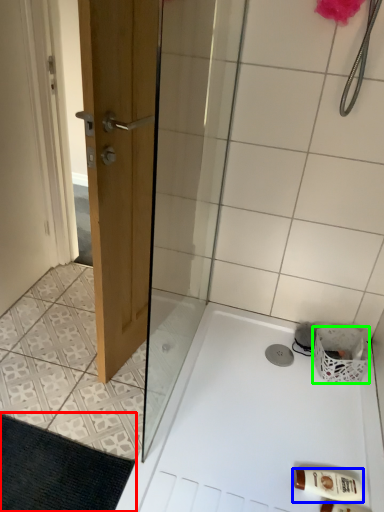
Question: Which object is positioned farthest from bath mat (highlighted by a red box)? Select from toiletry (highlighted by a blue box) and basket (highlighted by a green box).

Choices:
 (A) toiletry
 (B) basket

Answer: (B)